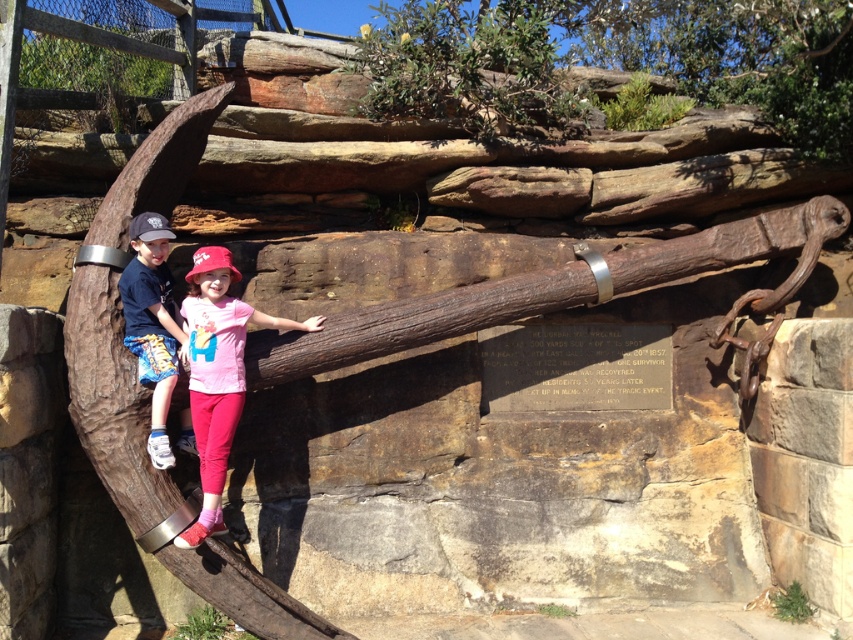
Can you confirm if matte pink shirt at center is wider than blue denim shorts at left?

Yes.

Between point (231, 280) and point (149, 442), which one is positioned behind?

Point (231, 280)

The height and width of the screenshot is (640, 853). Find the location of `matte pink shirt at center`. matte pink shirt at center is located at coordinates (218, 372).